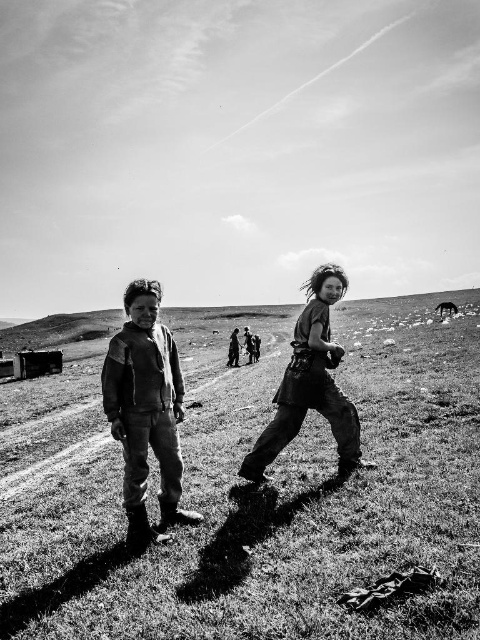
You are a photographer trying to capture a shot of the grass at center and the leather jacket at center. Based on their positions, which object is located to the right of the other?

The grass at center is to the right of the leather jacket at center.

You are standing at the origin point in the field. There is a grass at center located at point (254, 492). If you want to walk towards the grass at center, which direction should you move?

The grass at center is located at point (254, 492), so you should move towards the center of the field to reach it.